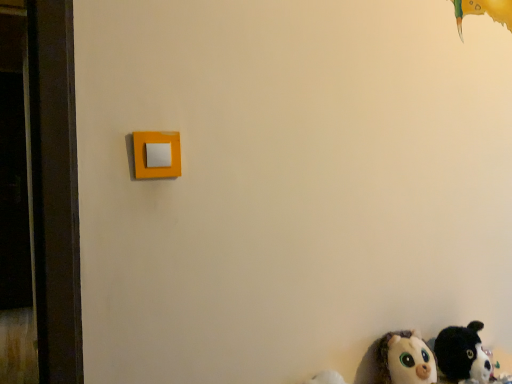
The height and width of the screenshot is (384, 512). Describe the element at coordinates (462, 354) in the screenshot. I see `fluffy plush cat at lower right, which is the 2th toy in left-to-right order` at that location.

Where is `fluffy plush cat at lower right, which is the first toy in right-to-left order`? The width and height of the screenshot is (512, 384). fluffy plush cat at lower right, which is the first toy in right-to-left order is located at coordinates (462, 354).

How much space does fluffy plush cat at lower right, which is the first toy in right-to-left order, occupy horizontally?

8.11 inches.

Measure the distance between point (450,369) and camera.

The depth of point (450,369) is 1.11 meters.

This screenshot has width=512, height=384. What do you see at coordinates (405, 359) in the screenshot?
I see `white plush toy at lower right, which appears as the second toy when viewed from the right` at bounding box center [405, 359].

Identify the location of white plush toy at lower right, which appears as the second toy when viewed from the right. (405, 359).

Measure the distance between white plush toy at lower right, which appears as the second toy when viewed from the right, and camera.

The depth of white plush toy at lower right, which appears as the second toy when viewed from the right, is 1.02 meters.

Image resolution: width=512 pixels, height=384 pixels. I want to click on fluffy plush cat at lower right, which is the first toy in right-to-left order, so click(x=462, y=354).

Which object is positioned more to the left, fluffy plush cat at lower right, which is the 2th toy in left-to-right order, or white plush toy at lower right, which appears as the second toy when viewed from the right?

white plush toy at lower right, which appears as the second toy when viewed from the right.

Does fluffy plush cat at lower right, which is the first toy in right-to-left order, lie behind white plush toy at lower right, which appears as the first toy when viewed from the left?

Yes.

Does point (482, 351) lie behind point (426, 346)?

Yes, point (482, 351) is farther from viewer.

From the image's perspective, is fluffy plush cat at lower right, which is the first toy in right-to-left order, above or below white plush toy at lower right, which appears as the second toy when viewed from the right?

From the image's perspective, fluffy plush cat at lower right, which is the first toy in right-to-left order, appears above white plush toy at lower right, which appears as the second toy when viewed from the right.

From a real-world perspective, which is physically below, fluffy plush cat at lower right, which is the first toy in right-to-left order, or white plush toy at lower right, which appears as the second toy when viewed from the right?

white plush toy at lower right, which appears as the second toy when viewed from the right, is physically lower.

Based on the photo, between fluffy plush cat at lower right, which is the first toy in right-to-left order, and white plush toy at lower right, which appears as the first toy when viewed from the left, which one has smaller width?

With smaller width is white plush toy at lower right, which appears as the first toy when viewed from the left.

Is fluffy plush cat at lower right, which is the first toy in right-to-left order, taller or shorter than white plush toy at lower right, which appears as the second toy when viewed from the right?

fluffy plush cat at lower right, which is the first toy in right-to-left order, is taller than white plush toy at lower right, which appears as the second toy when viewed from the right.

Who is bigger, fluffy plush cat at lower right, which is the 2th toy in left-to-right order, or white plush toy at lower right, which appears as the first toy when viewed from the left?

fluffy plush cat at lower right, which is the 2th toy in left-to-right order.

In the scene shown: Would you say white plush toy at lower right, which appears as the first toy when viewed from the left, is part of fluffy plush cat at lower right, which is the 2th toy in left-to-right order,'s contents?

No, white plush toy at lower right, which appears as the first toy when viewed from the left, is located outside of fluffy plush cat at lower right, which is the 2th toy in left-to-right order.

Are fluffy plush cat at lower right, which is the 2th toy in left-to-right order, and white plush toy at lower right, which appears as the first toy when viewed from the left, making contact?

There is a gap between fluffy plush cat at lower right, which is the 2th toy in left-to-right order, and white plush toy at lower right, which appears as the first toy when viewed from the left.

Could you tell me if fluffy plush cat at lower right, which is the 2th toy in left-to-right order, is turned towards white plush toy at lower right, which appears as the second toy when viewed from the right?

No, fluffy plush cat at lower right, which is the 2th toy in left-to-right order, is not facing towards white plush toy at lower right, which appears as the second toy when viewed from the right.

At what (x,y) coordinates should I click in order to perform the action: click on toy that appears in front of the fluffy plush cat at lower right, which is the first toy in right-to-left order. Please return your answer as a coordinate pair (x, y). This screenshot has width=512, height=384. Looking at the image, I should click on (405, 359).

Between white plush toy at lower right, which appears as the first toy when viewed from the left, and fluffy plush cat at lower right, which is the 2th toy in left-to-right order, which one appears on the left side from the viewer's perspective?

white plush toy at lower right, which appears as the first toy when viewed from the left.

Does white plush toy at lower right, which appears as the first toy when viewed from the left, lie in front of fluffy plush cat at lower right, which is the first toy in right-to-left order?

That is True.

Between point (397, 349) and point (469, 364), which one is positioned behind?

Point (469, 364)

From the image's perspective, between white plush toy at lower right, which appears as the first toy when viewed from the left, and fluffy plush cat at lower right, which is the first toy in right-to-left order, who is located below?

white plush toy at lower right, which appears as the first toy when viewed from the left, from the image's perspective.

In the scene shown: From a real-world perspective, is white plush toy at lower right, which appears as the second toy when viewed from the right, positioned under fluffy plush cat at lower right, which is the 2th toy in left-to-right order, based on gravity?

Yes, from a real-world perspective, white plush toy at lower right, which appears as the second toy when viewed from the right, is beneath fluffy plush cat at lower right, which is the 2th toy in left-to-right order.

Considering the relative sizes of white plush toy at lower right, which appears as the first toy when viewed from the left, and fluffy plush cat at lower right, which is the 2th toy in left-to-right order, in the image provided, is white plush toy at lower right, which appears as the first toy when viewed from the left, thinner than fluffy plush cat at lower right, which is the 2th toy in left-to-right order,?

Indeed, white plush toy at lower right, which appears as the first toy when viewed from the left, has a lesser width compared to fluffy plush cat at lower right, which is the 2th toy in left-to-right order.

In terms of height, does white plush toy at lower right, which appears as the second toy when viewed from the right, look taller or shorter compared to fluffy plush cat at lower right, which is the first toy in right-to-left order?

Considering their sizes, white plush toy at lower right, which appears as the second toy when viewed from the right, has less height than fluffy plush cat at lower right, which is the first toy in right-to-left order.

Which of these two, white plush toy at lower right, which appears as the second toy when viewed from the right, or fluffy plush cat at lower right, which is the 2th toy in left-to-right order, is bigger?

fluffy plush cat at lower right, which is the 2th toy in left-to-right order.

Can we say white plush toy at lower right, which appears as the first toy when viewed from the left, lies outside fluffy plush cat at lower right, which is the first toy in right-to-left order?

That's correct, white plush toy at lower right, which appears as the first toy when viewed from the left, is outside of fluffy plush cat at lower right, which is the first toy in right-to-left order.

Is white plush toy at lower right, which appears as the second toy when viewed from the right, directly adjacent to fluffy plush cat at lower right, which is the first toy in right-to-left order?

No.

Based on the photo, is white plush toy at lower right, which appears as the second toy when viewed from the right, turned away from fluffy plush cat at lower right, which is the first toy in right-to-left order?

That's not correct — white plush toy at lower right, which appears as the second toy when viewed from the right, is not looking away from fluffy plush cat at lower right, which is the first toy in right-to-left order.

Locate an element on the screen. The width and height of the screenshot is (512, 384). toy on the left side of fluffy plush cat at lower right, which is the 2th toy in left-to-right order is located at coordinates (405, 359).

The height and width of the screenshot is (384, 512). In order to click on toy lying below the fluffy plush cat at lower right, which is the first toy in right-to-left order (from the image's perspective) in this screenshot , I will do `click(405, 359)`.

This screenshot has height=384, width=512. I want to click on toy that appears on the right of white plush toy at lower right, which appears as the first toy when viewed from the left, so click(x=462, y=354).